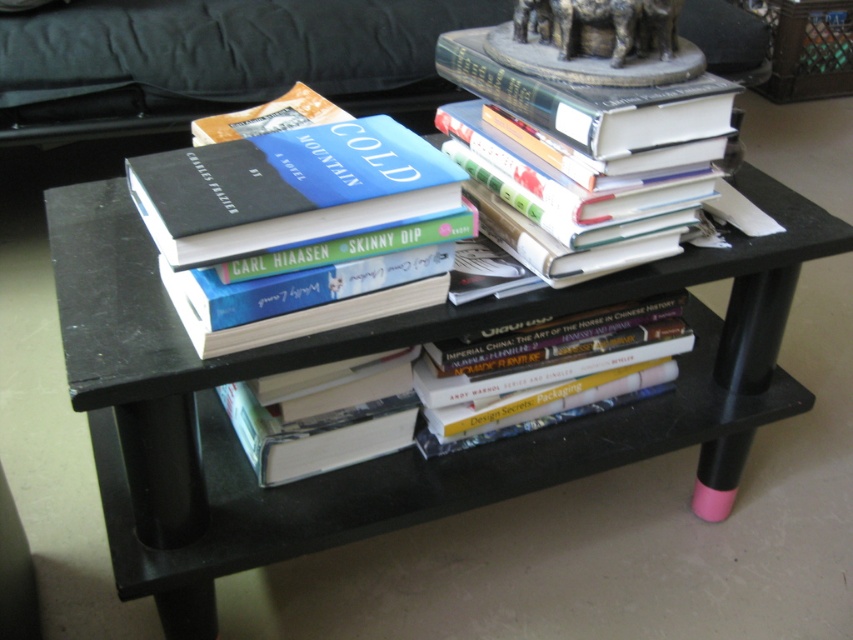
You are organizing the books on the table and notice the matte black book at center and the hardcover books at center. Which one is located below the other?

The matte black book at center is positioned under the hardcover books at center.

You are standing in front of the black two tiered table with books. There is a point marked at coordinate (370,352). What object is located at that point?

The point at coordinate (370,352) indicates the location of the black matte table at center.

You have a small bookshelf that can only accommodate books narrower than 10 cm. You see the matte black book at center and the hardcover book at center on the table. Which book should you choose to place on the shelf?

The matte black book at center has a width less than the hardcover book at center, so it is narrower and would fit on the small bookshelf.